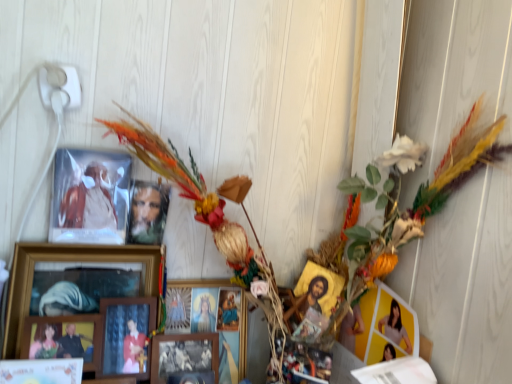
Question: Considering the relative sizes of wooden picture frame at lower left, the 7th picture frame when ordered from right to left, and gold textured icon at center-right, which is the first picture frame from right to left, in the image provided, is wooden picture frame at lower left, the 7th picture frame when ordered from right to left, wider than gold textured icon at center-right, which is the first picture frame from right to left,?

Choices:
 (A) yes
 (B) no

Answer: (A)

Question: Is wooden picture frame at lower left, the 7th picture frame when ordered from right to left, turned away from gold textured icon at center-right, which is the first picture frame from right to left?

Choices:
 (A) no
 (B) yes

Answer: (A)

Question: From the image's perspective, is wooden picture frame at lower left, which appears as the second picture frame when viewed from the left, below gold textured icon at center-right, which is the first picture frame from right to left?

Choices:
 (A) no
 (B) yes

Answer: (B)

Question: From a real-world perspective, is wooden picture frame at lower left, which appears as the second picture frame when viewed from the left, physically above gold textured icon at center-right, which is the first picture frame from right to left?

Choices:
 (A) no
 (B) yes

Answer: (A)

Question: Is wooden picture frame at lower left, which appears as the second picture frame when viewed from the left, further to camera compared to gold textured icon at center-right, which is the 8th picture frame in left-to-right order?

Choices:
 (A) yes
 (B) no

Answer: (B)

Question: From the image's perspective, is wooden picture frame at lower left, the 7th picture frame when ordered from right to left, over gold textured icon at center-right, which is the first picture frame from right to left?

Choices:
 (A) yes
 (B) no

Answer: (B)

Question: Is multicolored feathered wreath at upper left completely or partially outside of wooden framed picture at center, the second picture frame positioned from the right?

Choices:
 (A) no
 (B) yes

Answer: (B)

Question: Could wooden framed picture at center, the second picture frame positioned from the right, be considered to be inside multicolored feathered wreath at upper left?

Choices:
 (A) yes
 (B) no

Answer: (A)

Question: Is the position of multicolored feathered wreath at upper left less distant than that of wooden framed picture at center, the second picture frame positioned from the right?

Choices:
 (A) no
 (B) yes

Answer: (B)

Question: Are multicolored feathered wreath at upper left and wooden framed picture at center, the second picture frame positioned from the right, making contact?

Choices:
 (A) yes
 (B) no

Answer: (B)

Question: Is multicolored feathered wreath at upper left further to camera compared to wooden framed picture at center, the second picture frame positioned from the right?

Choices:
 (A) yes
 (B) no

Answer: (B)

Question: Can you confirm if multicolored feathered wreath at upper left is shorter than wooden framed picture at center, the second picture frame positioned from the right?

Choices:
 (A) yes
 (B) no

Answer: (B)

Question: From a real-world perspective, does wooden picture frame at lower left, which appears as the second picture frame when viewed from the left, sit lower than wooden photo frame at center, marked as the sixth picture frame in a left-to-right arrangement?

Choices:
 (A) no
 (B) yes

Answer: (A)